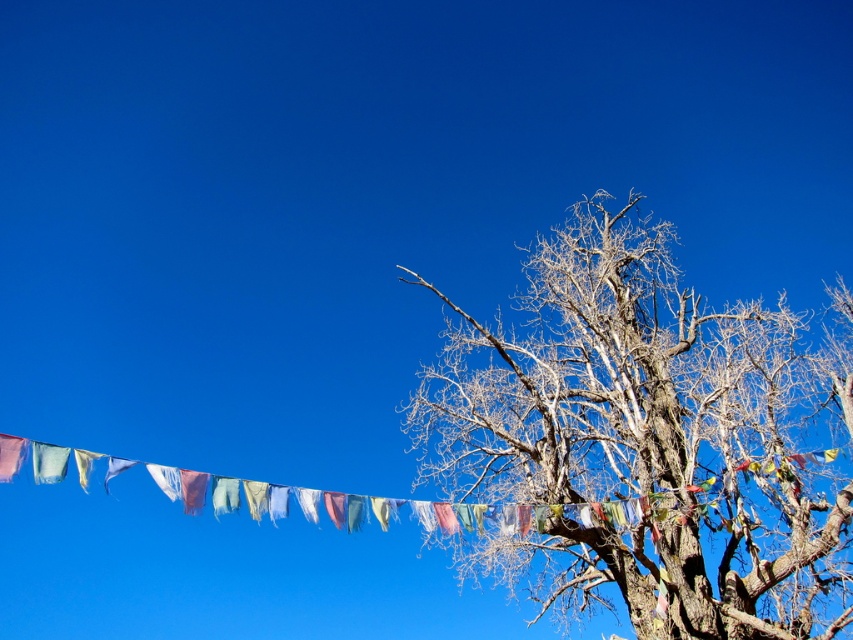
Who is shorter, dead wood tree at right or matte blue flag at upper left?

matte blue flag at upper left is shorter.

Between point (750, 397) and point (21, 438), which one is positioned in front?

Point (21, 438) is in front.

Where is `dead wood tree at right`? The width and height of the screenshot is (853, 640). dead wood tree at right is located at coordinates (648, 440).